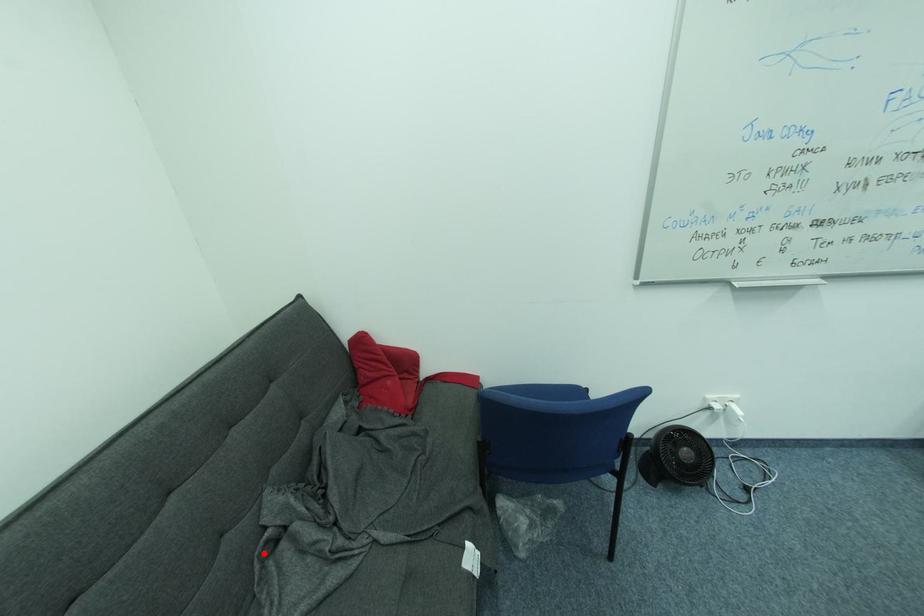
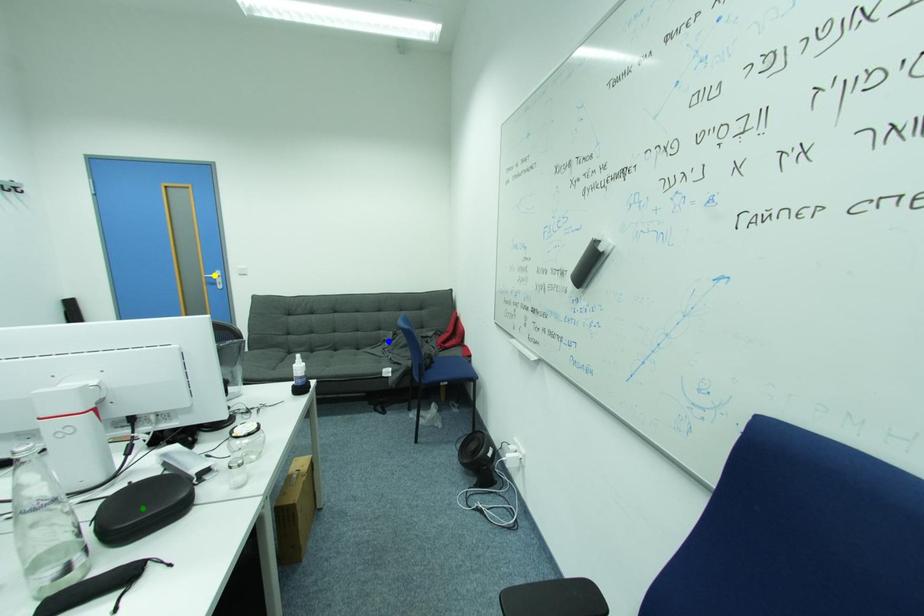
Question: I am providing you with two images of the same scene from different viewpoints. A red point is marked on the first image. You are given multiple points on the second image. Which point in image 2 is actually the same real-world point as the red point in image 1?

Choices:
 (A) blue point
 (B) green point
 (C) yellow point

Answer: (A)